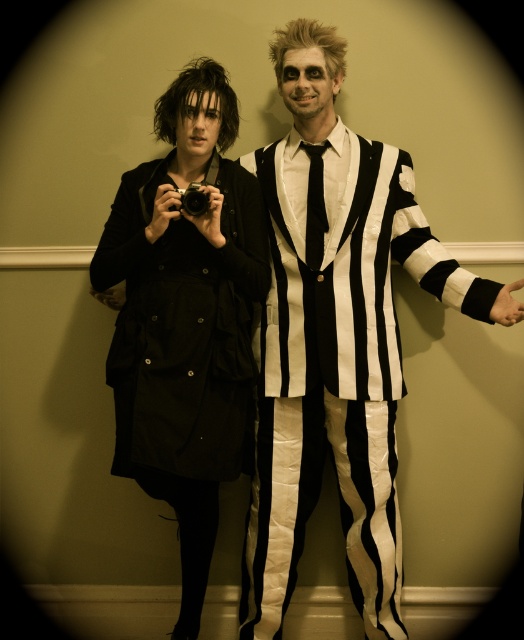
Question: In this image, where is black matte coat at left located relative to black plastic camera at center?

Choices:
 (A) left
 (B) right

Answer: (A)

Question: Can you confirm if black matte coat at left is thinner than black plastic camera at center?

Choices:
 (A) yes
 (B) no

Answer: (B)

Question: Which of the following is the farthest from the observer?

Choices:
 (A) black matte coat at left
 (B) black plastic camera at center

Answer: (B)

Question: Is black matte coat at left closer to camera compared to black plastic camera at center?

Choices:
 (A) yes
 (B) no

Answer: (A)

Question: Which point is farther from the camera taking this photo?

Choices:
 (A) (187, 198)
 (B) (165, 196)

Answer: (A)

Question: Among these objects, which one is nearest to the camera?

Choices:
 (A) black plastic camera at center
 (B) black matte coat at left

Answer: (B)